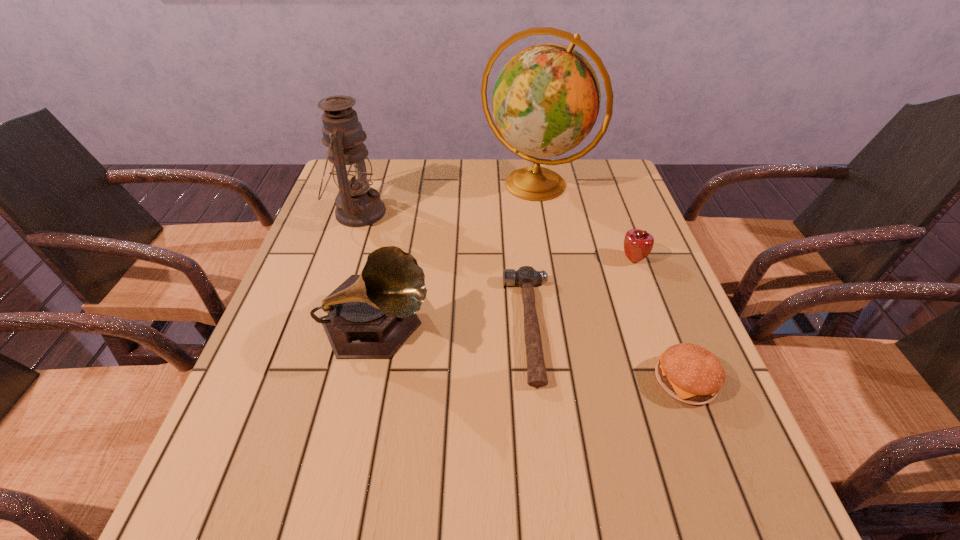
In order to click on the tallest object in this screenshot , I will do `click(546, 99)`.

Locate an element on the screen. This screenshot has width=960, height=540. the fifth shortest object is located at coordinates [x=357, y=205].

The image size is (960, 540). What are the coordinates of `phonograph record` in the screenshot? It's located at (370, 316).

You are a GUI agent. You are given a task and a screenshot of the screen. Output one action in this format:
    pyautogui.click(x=<x>, y=<y>)
    Task: Click on the fourth tallest object
    The image size is (960, 540).
    Given the screenshot: What is the action you would take?
    pyautogui.click(x=638, y=244)

Locate an element on the screen. The height and width of the screenshot is (540, 960). apple is located at coordinates (638, 244).

Where is `the fifth tallest object`? This screenshot has height=540, width=960. the fifth tallest object is located at coordinates (688, 372).

The width and height of the screenshot is (960, 540). Find the location of `the shortest object`. the shortest object is located at coordinates (526, 277).

The image size is (960, 540). I want to click on vacant space situated on the left of the tallest object, so click(x=381, y=185).

Where is `free space located on the right of the second tallest object`? Image resolution: width=960 pixels, height=540 pixels. free space located on the right of the second tallest object is located at coordinates (466, 212).

You are a GUI agent. You are given a task and a screenshot of the screen. Output one action in this format:
    pyautogui.click(x=<x>, y=<y>)
    Task: Click on the vacant region located on the horn direction of the third tallest object
    Image resolution: width=960 pixels, height=540 pixels.
    Given the screenshot: What is the action you would take?
    pyautogui.click(x=470, y=329)